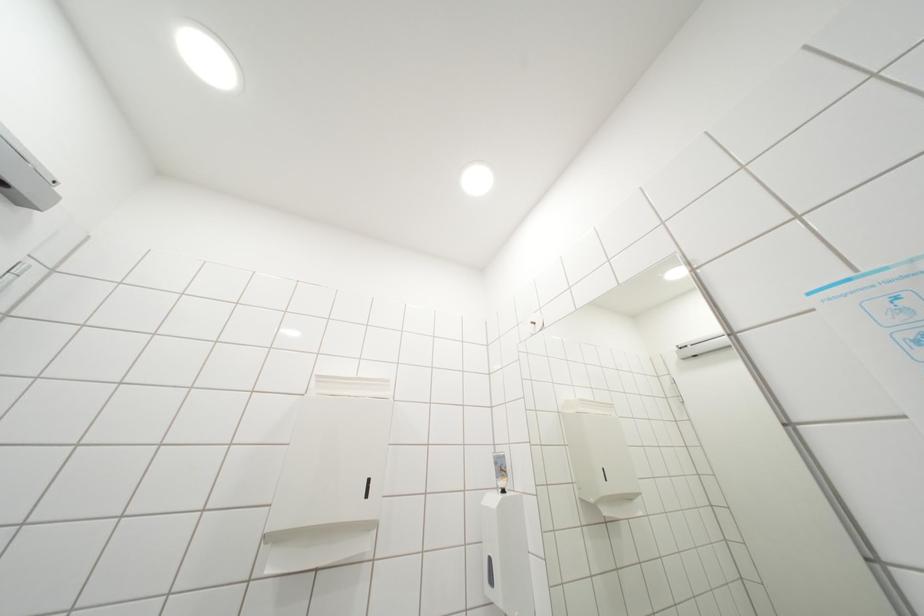
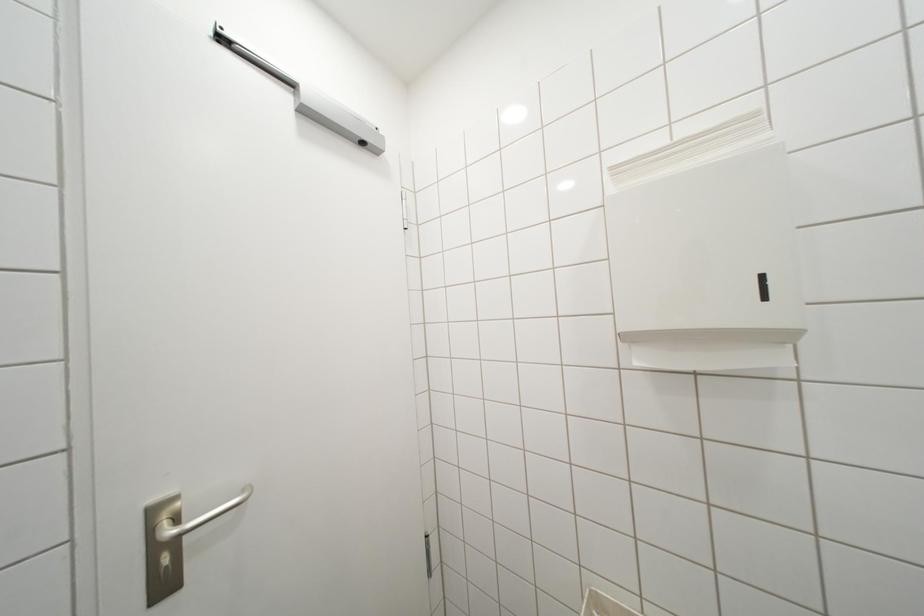
Question: The camera is either moving clockwise (left) or counter-clockwise (right) around the object. The first image is from the beginning of the video and the second image is from the end. Is the camera moving left or right when shooting the video?

Choices:
 (A) Left
 (B) Right

Answer: (B)